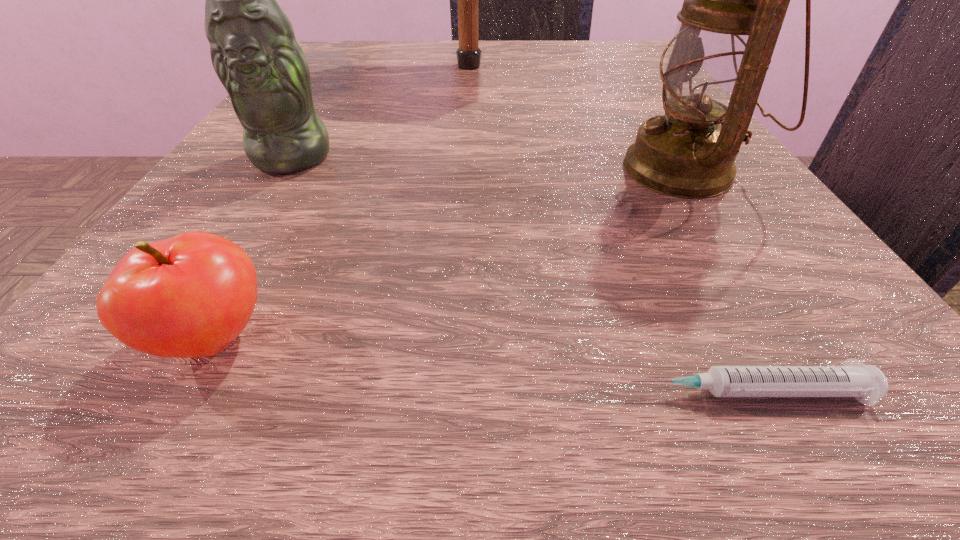
In order to click on object at the near left corner in this screenshot , I will do `click(189, 296)`.

Where is `object that is at the near right corner`? object that is at the near right corner is located at coordinates (866, 383).

I want to click on vacant space at the far edge of the desktop, so click(496, 78).

Locate an element on the screen. free spot at the near edge of the desktop is located at coordinates (372, 361).

Identify the location of vacant point at the left edge. (196, 225).

Where is `blank space at the right edge`? The height and width of the screenshot is (540, 960). blank space at the right edge is located at coordinates pyautogui.click(x=743, y=191).

You are a GUI agent. You are given a task and a screenshot of the screen. Output one action in this format:
    pyautogui.click(x=<x>, y=<y>)
    Task: Click on the vacant space at the far right corner
    
    Given the screenshot: What is the action you would take?
    pyautogui.click(x=559, y=42)

The image size is (960, 540). What are the coordinates of `vacant point located between the apple and the third object from right to left` in the screenshot? It's located at (341, 202).

Find the location of a particular element. vacant space that is in between the beer bottle and the oil lamp is located at coordinates (488, 163).

In order to click on empty location between the shortest object and the beer bottle in this screenshot , I will do coord(518,274).